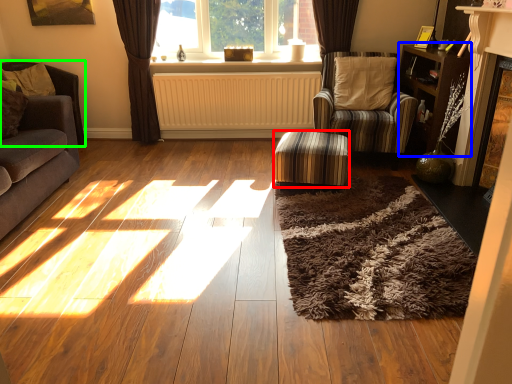
Question: Which object is the closest to the stool (highlighted by a red box)? Choose among these: bookshelf (highlighted by a blue box) or armchair (highlighted by a green box).

Choices:
 (A) bookshelf
 (B) armchair

Answer: (A)